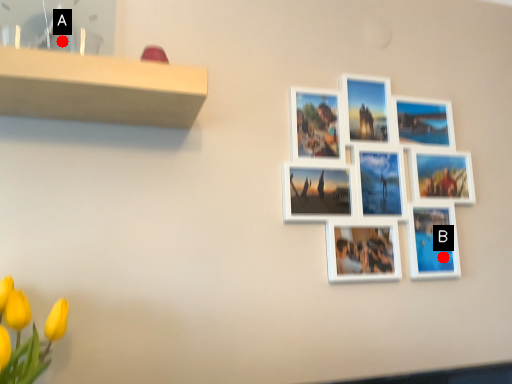
Question: Two points are circled on the image, labeled by A and B beside each circle. Which of the following is the farthest from the observer?

Choices:
 (A) A is further
 (B) B is further

Answer: (B)